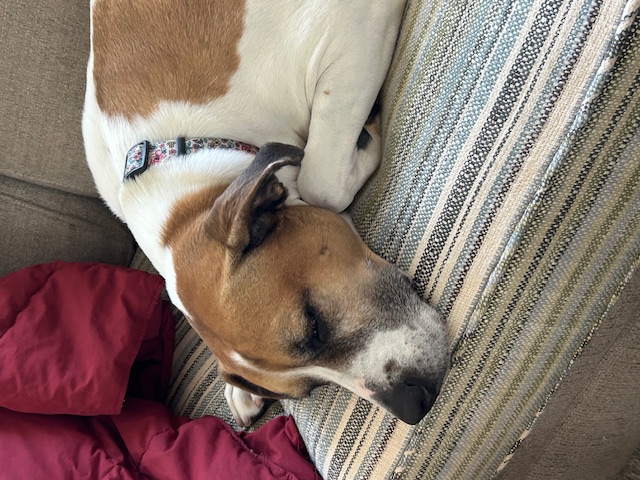
Image resolution: width=640 pixels, height=480 pixels. Identify the location of cushion. (456, 367), (114, 142), (461, 39), (333, 31).